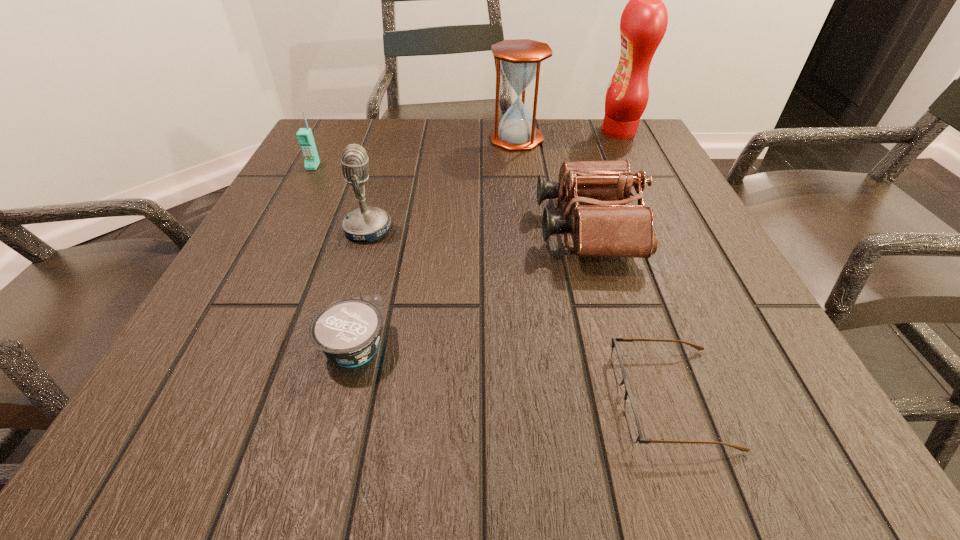
Where is `object that is at the far right corner`? object that is at the far right corner is located at coordinates (643, 24).

Locate an element on the screen. The height and width of the screenshot is (540, 960). object that is at the near right corner is located at coordinates (631, 415).

The height and width of the screenshot is (540, 960). I want to click on vacant space at the far edge of the desktop, so click(x=382, y=152).

Where is `blank area at the near edge`? blank area at the near edge is located at coordinates (533, 422).

Identify the location of vacant space at the left edge. (246, 244).

Where is `vacant area at the right edge of the desktop`? This screenshot has width=960, height=540. vacant area at the right edge of the desktop is located at coordinates (652, 263).

Locate an element on the screen. vacant space at the far left corner of the desktop is located at coordinates (353, 129).

At what (x,y) coordinates should I click in order to perform the action: click on vacant space at the far right corner. Please return your answer as a coordinate pair (x, y). This screenshot has width=960, height=540. Looking at the image, I should click on (636, 144).

Find the location of `blank space at the near right corner`. blank space at the near right corner is located at coordinates (764, 392).

Locate an element on the screen. vacant region between the cellular telephone and the microphone is located at coordinates (341, 198).